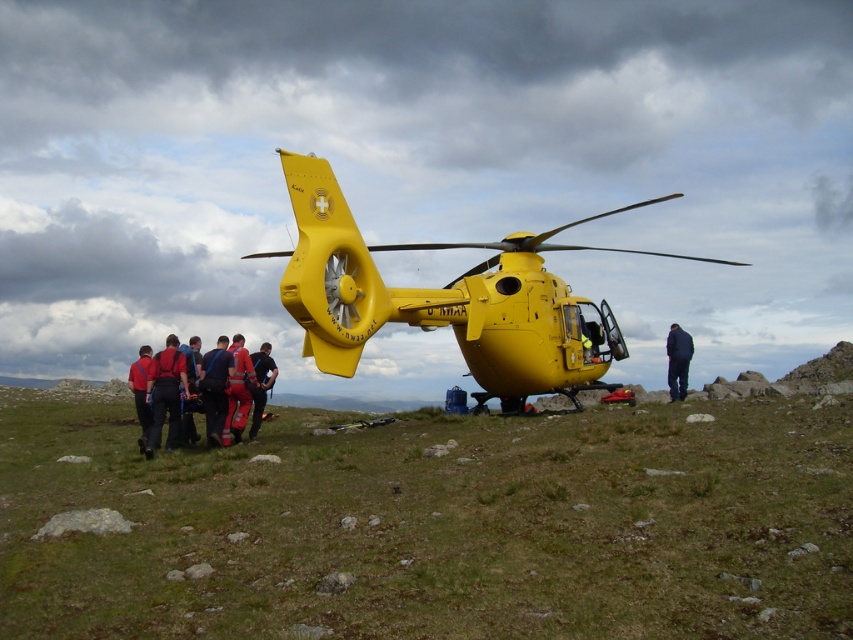
Can you confirm if red fabric pants at center is thinner than dark blue fabric pants at right?

Correct, red fabric pants at center's width is less than dark blue fabric pants at right's.

Between red fabric pants at center and dark blue fabric pants at right, which one appears on the left side from the viewer's perspective?

From the viewer's perspective, red fabric pants at center appears more on the left side.

Is point (236, 365) positioned behind point (666, 337)?

No, it is in front of (666, 337).

You are a GUI agent. You are given a task and a screenshot of the screen. Output one action in this format:
    pyautogui.click(x=<x>, y=<y>)
    Task: Click on the red fabric pants at center
    This screenshot has height=640, width=853.
    Given the screenshot: What is the action you would take?
    pyautogui.click(x=238, y=392)

Is red fabric pants at center positioned behind red reflective suit at center?

No, it is in front of red reflective suit at center.

This screenshot has height=640, width=853. Find the location of `red fabric pants at center`. red fabric pants at center is located at coordinates (238, 392).

Where is `red fabric jacket at left`? The image size is (853, 640). red fabric jacket at left is located at coordinates (141, 392).

How far apart are red fabric jacket at left and red reflective suit at center?

red fabric jacket at left is 1.70 meters from red reflective suit at center.

Identify the location of red fabric jacket at left. (141, 392).